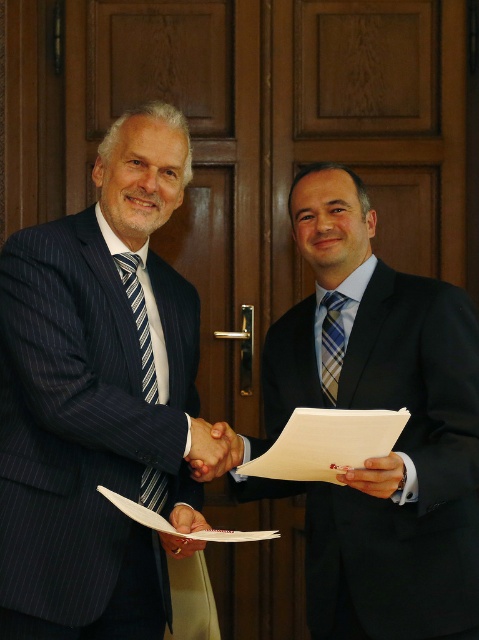
You are an observer standing in front of the two men. Which object is taller between the blue pinstripe suit at center and the smooth skin hand at center?

The blue pinstripe suit at center is much taller than the smooth skin hand at center.

You are an observer standing in front of the image. You notice the blue pinstripe suit at center and the smooth skin hand at center. Which object is covering the other?

The blue pinstripe suit at center is positioned over the smooth skin hand at center, so it is covering it.

You are a photographer setting up for a formal event. You need to position a spotlight so it illuminates both the matte black suit at center and the striped fabric tie at left without casting shadows on the wooden door behind them. Given their positions, which object should you focus the light closer to first?

The matte black suit at center is in front of the striped fabric tie at left, so you should focus the spotlight closer to the matte black suit at center first to ensure both are illuminated without casting shadows on the wooden door behind them.